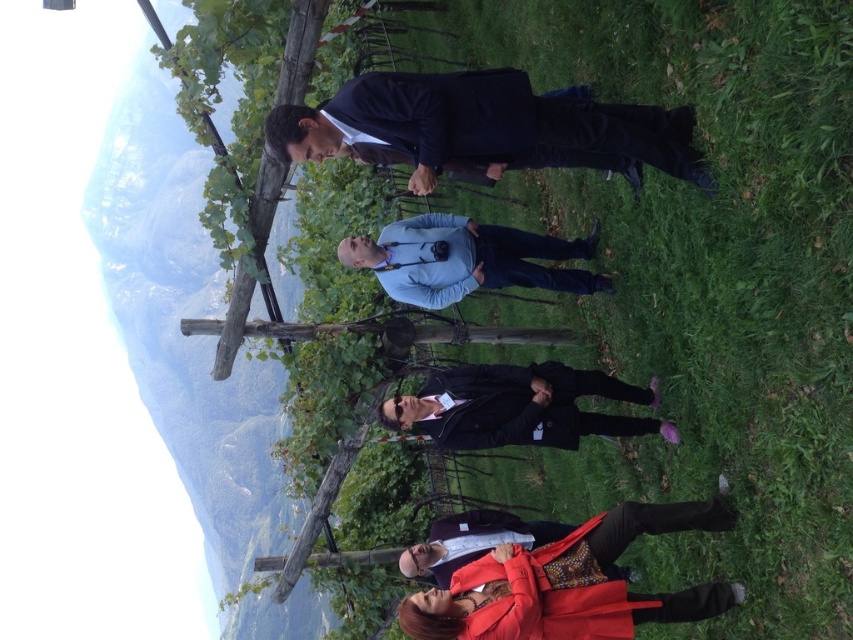
From the picture: You are standing in the vineyard scene and want to move from the point at coordinates point (434, 220) to the point at coordinates point (537, 614). Which direction should you move to get closer to your destination?

To move from point (434, 220) to point (537, 614), you should move towards the right and slightly upwards since point (537, 614) is located to the right and higher up compared to point (434, 220).